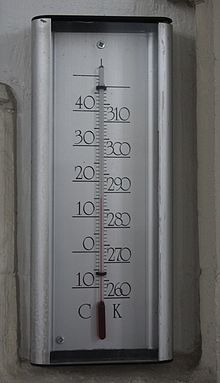
Identify the location of wall corner. The width and height of the screenshot is (220, 383). (191, 338).